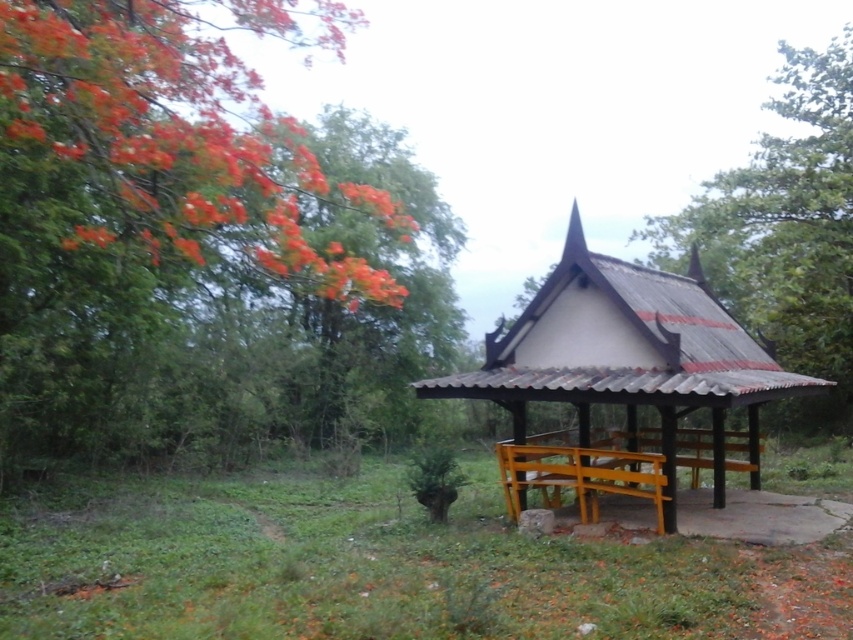
You are a photographer positioned in front of the pavilion. You want to capture a photo that includes both the orange blossoms at upper left and the green leafy tree at upper right. Based on their positions, which object would appear closer to the camera in the final image?

The orange blossoms at upper left would appear closer to the camera because they are positioned in front of the green leafy tree at upper right.

You are standing in front of the pavilion and want to take a photo that includes both point (689, 396) and point (764, 330). Which point will appear larger in your photo?

Point (689, 396) is closer to the camera than point (764, 330), so it will appear larger in the photo.

You are an artist planning to paint the view from the pavilion. You want to include both the orange blossoms at upper left and the green leafy tree at upper right in your painting. Which of these two objects should you depict as smaller in your painting?

The orange blossoms at upper left should be depicted as smaller in the painting because it is not as tall as the green leafy tree at upper right.